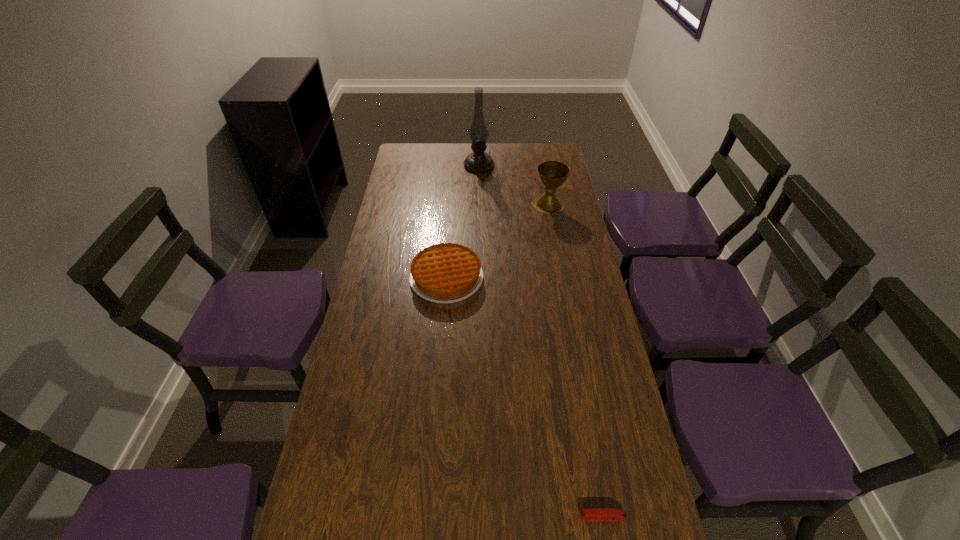
Where is `vacant space that's between the oil lamp and the third tallest object`? The width and height of the screenshot is (960, 540). vacant space that's between the oil lamp and the third tallest object is located at coordinates (463, 222).

Point out which object is positioned as the nearest to the chalice. Please provide its 2D coordinates. Your answer should be formatted as a tuple, i.e. [(x, y)], where the tuple contains the x and y coordinates of a point satisfying the conditions above.

[(479, 161)]

Identify the location of object identified as the closest to the tallest object. (552, 174).